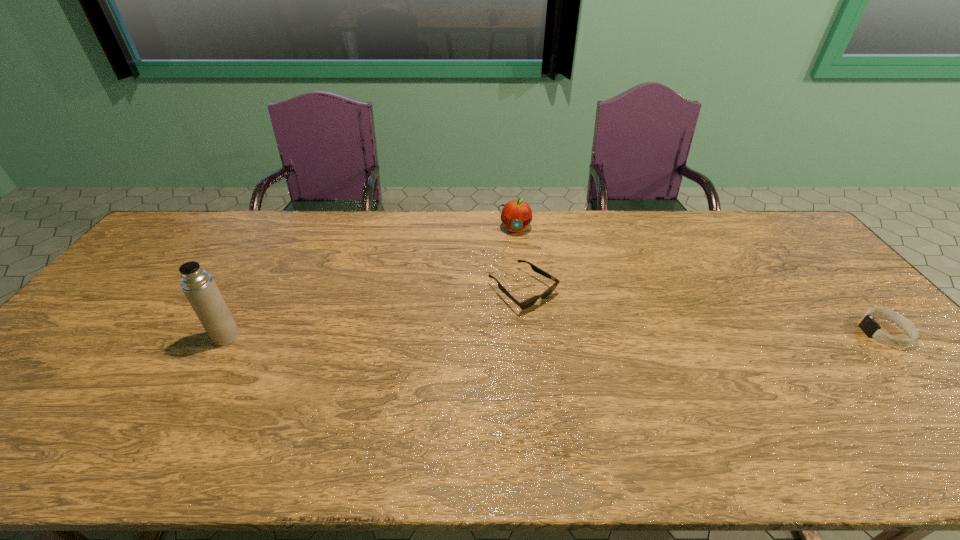
Locate an element on the screen. Image resolution: width=960 pixels, height=540 pixels. free space on the desktop that is between the thermos bottle and the rightmost object and is positioned on the surface of the second tallest object is located at coordinates (515, 335).

At what (x,y) coordinates should I click in order to perform the action: click on free spot on the desktop that is between the leftmost object and the wristband and is positioned on the front-facing side of the third nearest object. Please return your answer as a coordinate pair (x, y). The height and width of the screenshot is (540, 960). Looking at the image, I should click on (578, 334).